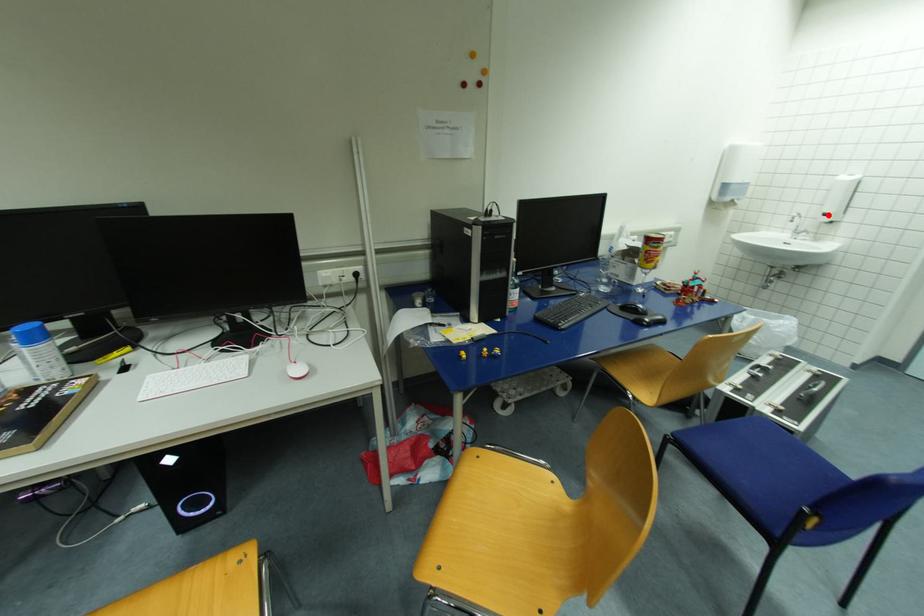
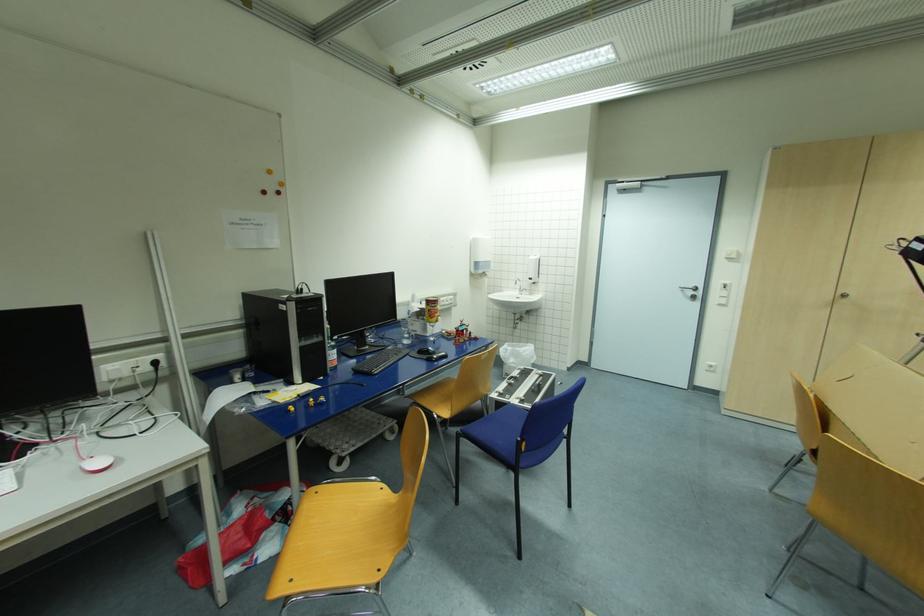
Question: I am providing you with two images of the same scene from different viewpoints. Given a red point in image1, look at the same physical point in image2. Is it:

Choices:
 (A) Closer to the viewpoint
 (B) Farther from the viewpoint

Answer: (A)